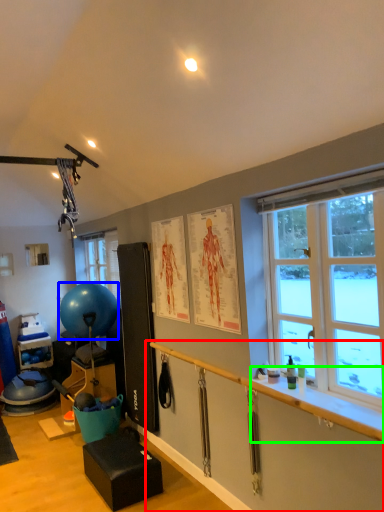
Question: Which object is the farthest from garage door (highlighted by a red box)? Choose among these: ball (highlighted by a blue box) or window sill (highlighted by a green box).

Choices:
 (A) ball
 (B) window sill

Answer: (A)